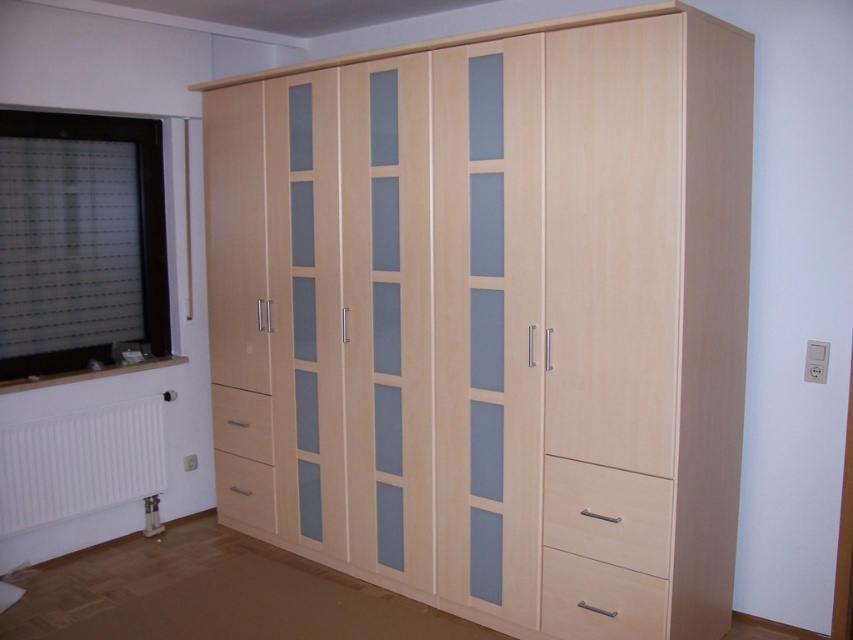
You are trying to decide where to place a tall floor lamp in the room. The lamp requires at least 1.5 meters of clearance above it to avoid hitting the ceiling. Given the height of the light wood dresser at center and the white matte radiator at lower left, do you think the lamp can be placed between them without any issues?

The light wood dresser at center has a greater height compared to the white matte radiator at lower left. Since the lamp requires 1.5 meters of clearance, you need to ensure there is enough vertical space between the tallest object, which is the light wood dresser at center, and the ceiling. If the distance from the dresser to the ceiling is at least 1.5 meters, then placing the lamp between them should be safe.

From the picture: You are organizing clothes in the wardrobe and need to place a pair of shoes in the smaller drawer. Which drawer should you choose between the light wood drawer at lower right and the matte light brown drawer at lower left?

The light wood drawer at lower right is smaller than the matte light brown drawer at lower left, so you should choose the light wood drawer at lower right for the shoes.

You are a home inspector assessing the room. You notice the white matte radiator at lower left and the light wood drawer at lower left. Which one is positioned higher up on the wall?

The white matte radiator at lower left is above the light wood drawer at lower left, so the radiator is positioned higher up on the wall.